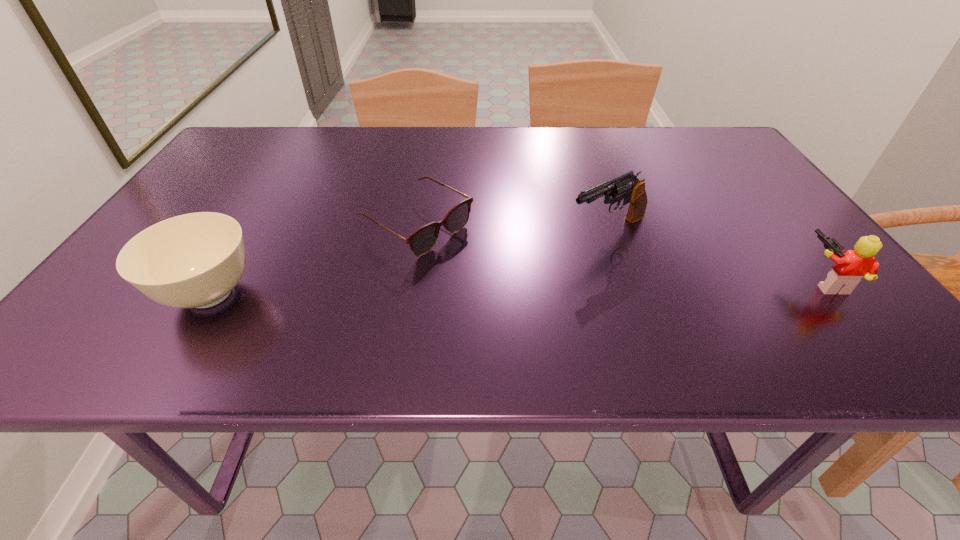
Identify the location of vacant space located along the barrel of the second object from right to left. Image resolution: width=960 pixels, height=540 pixels. (485, 288).

Locate an element on the screen. Image resolution: width=960 pixels, height=540 pixels. free space located 0.130m along the barrel of the second object from right to left is located at coordinates coord(528,267).

Locate an element on the screen. The width and height of the screenshot is (960, 540). free space located at the front view of the second object from left to right is located at coordinates (514, 283).

Locate an element on the screen. free location located at the front view of the second object from left to right is located at coordinates (521, 287).

This screenshot has height=540, width=960. In order to click on free space located 0.080m at the front view of the second object from left to right in this screenshot , I will do `click(487, 267)`.

The image size is (960, 540). What are the coordinates of `sugar bowl that is at the near edge` in the screenshot? It's located at (195, 260).

Locate an element on the screen. Image resolution: width=960 pixels, height=540 pixels. Lego at the near edge is located at coordinates (849, 268).

Locate an element on the screen. This screenshot has height=540, width=960. object present at the left edge is located at coordinates (195, 260).

Identify the location of object located in the right edge section of the desktop. The width and height of the screenshot is (960, 540). (849, 268).

Identify the location of object at the near left corner. The height and width of the screenshot is (540, 960). (195, 260).